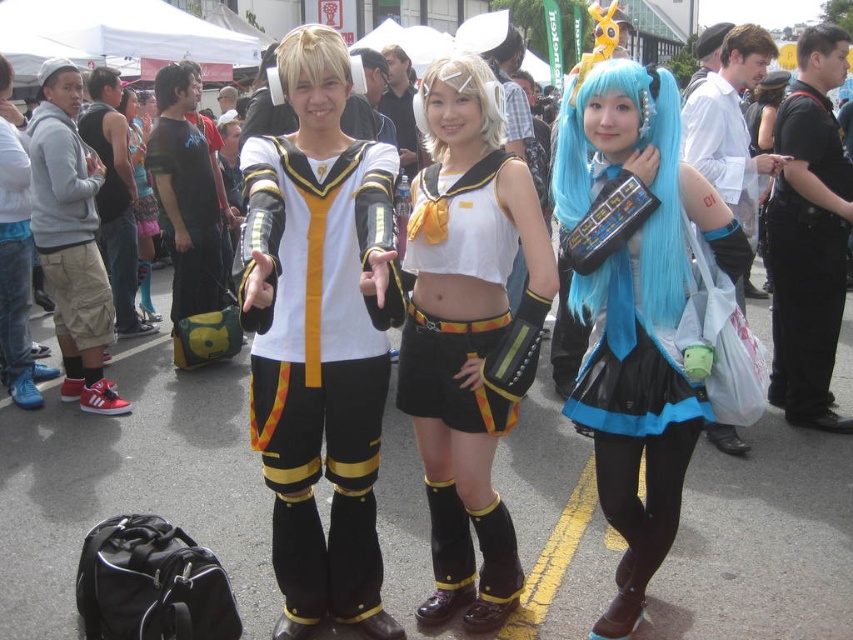
You are a photographer at the event and want to capture a group photo of the white matte uniform at center and the black leather jacket at upper right. Which one should you position closer to the edges of the frame to ensure both fit in the shot?

Since the white matte uniform at center might be wider than the black leather jacket at upper right, positioning the wider white matte uniform at center closer to the center of the frame and the narrower black leather jacket at upper right near the edge would help both fit within the shot.

You are a photographer at the event and need to capture both the matte black and yellow armor at center and the black leather jacket at upper right in the same frame. Which object should you focus on first to ensure both are in the frame?

You should focus on the matte black and yellow armor at center first because it is shorter than the black leather jacket at upper right, so positioning the camera to include the taller object first will help ensure both are captured in the frame.